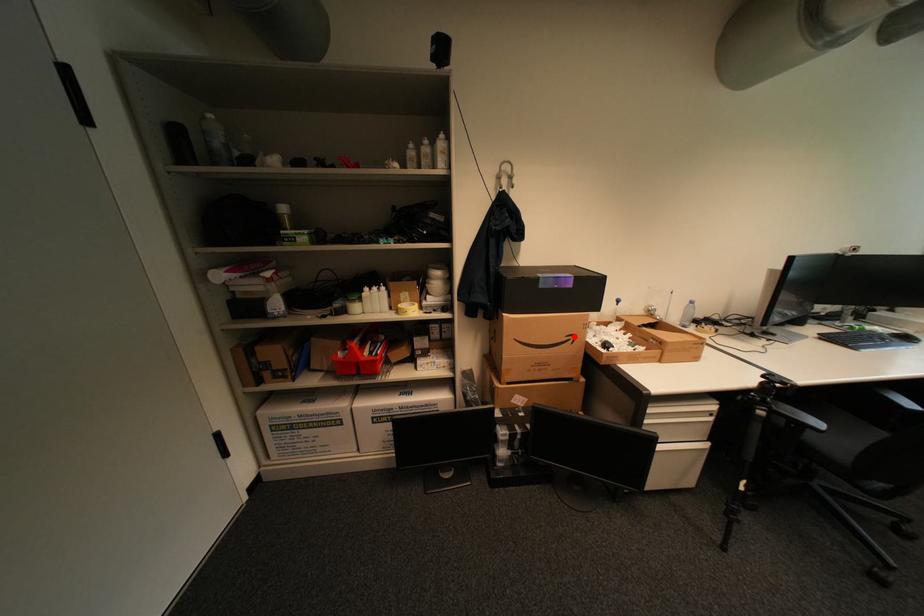
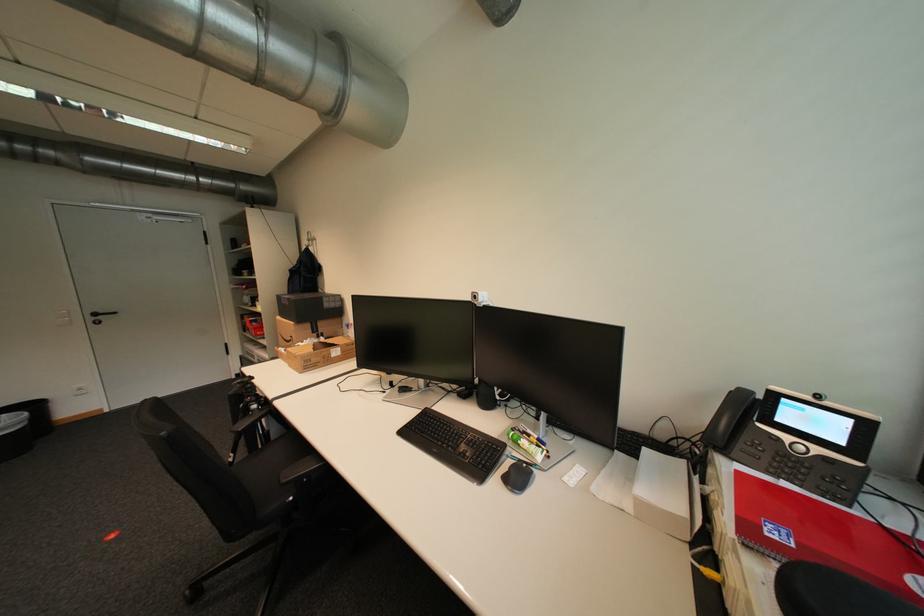
Where in the second image is the point corresponding to the highlighted location from the first image?

(299, 338)